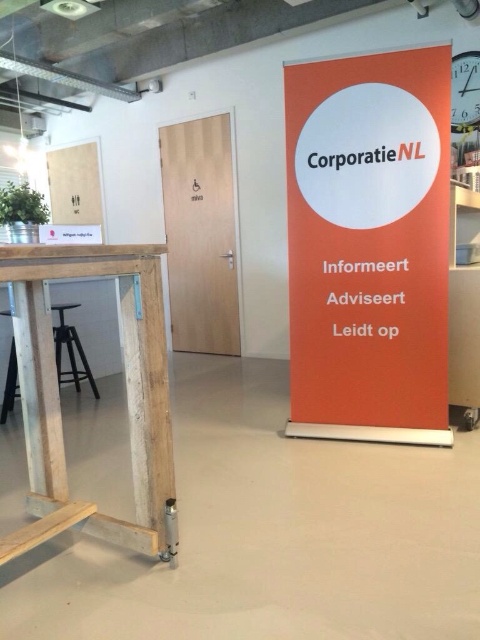
From the picture: You are an office assistant who needs to hang a new poster. There is a point marked at coordinates (x=74, y=184). What object is located at this point?

The point at coordinates (x=74, y=184) marks the white matte paper at upper left.